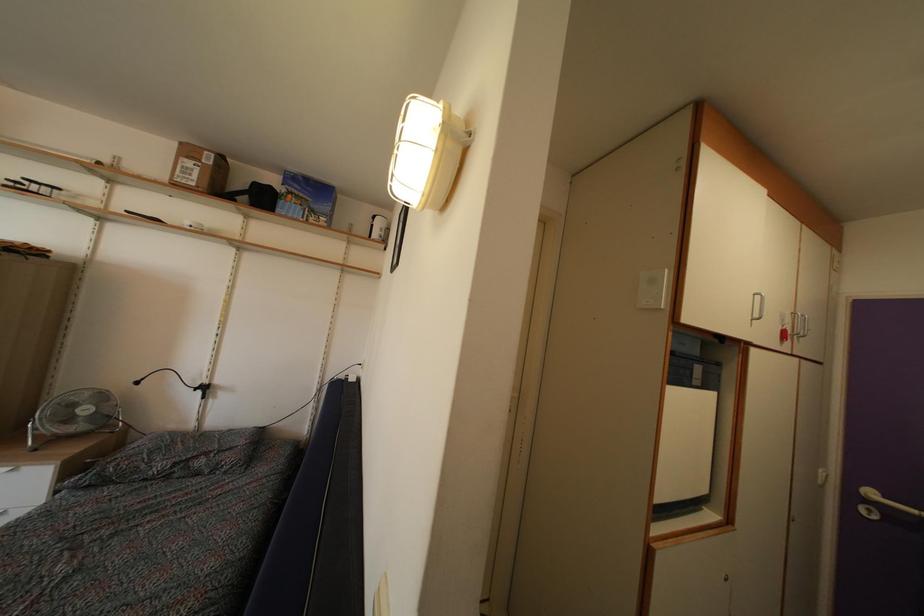
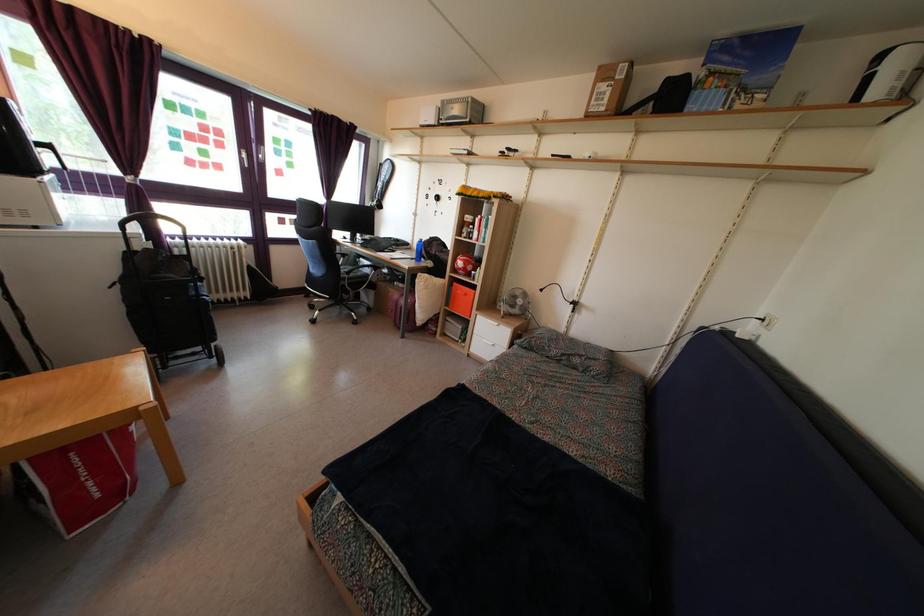
Question: The camera is either moving clockwise (left) or counter-clockwise (right) around the object. The first image is from the beginning of the video and the second image is from the end. Is the camera moving left or right when shooting the video?

Choices:
 (A) Left
 (B) Right

Answer: (B)